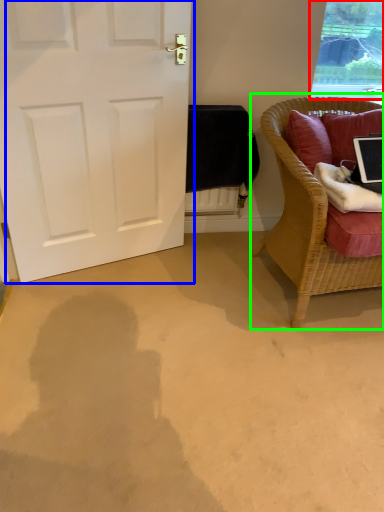
Question: Which object is positioned farthest from window (highlighted by a red box)? Select from door (highlighted by a blue box) and chair (highlighted by a green box).

Choices:
 (A) door
 (B) chair

Answer: (A)